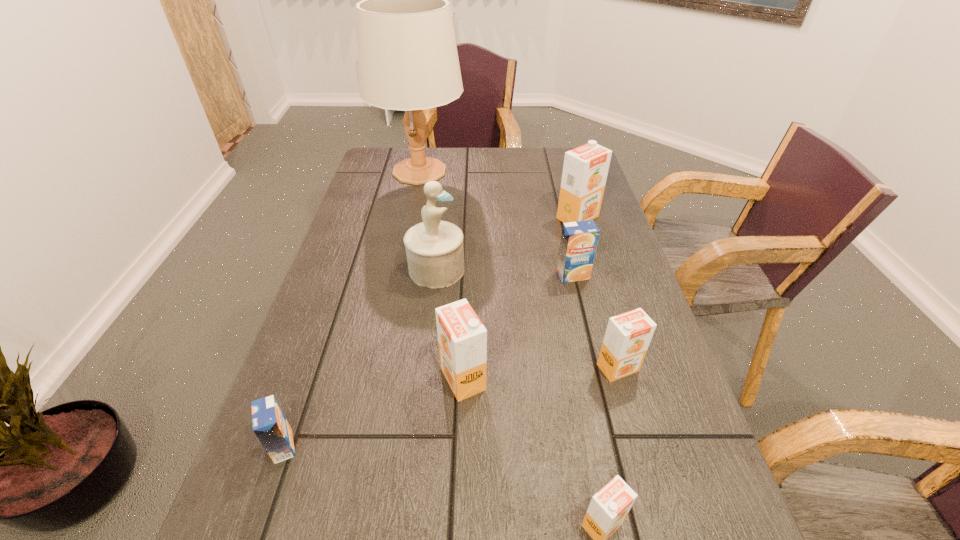
Image resolution: width=960 pixels, height=540 pixels. Find the location of `table lamp located at the left edge`. table lamp located at the left edge is located at coordinates (407, 55).

Image resolution: width=960 pixels, height=540 pixels. I want to click on orange_juice present at the left edge, so click(269, 424).

You are a GUI agent. You are given a task and a screenshot of the screen. Output one action in this format:
    pyautogui.click(x=<x>, y=<y>)
    Task: Click on the object situated at the far left corner
    
    Given the screenshot: What is the action you would take?
    pyautogui.click(x=407, y=55)

Identify the location of vacant space at the far edge of the desktop. This screenshot has width=960, height=540. (538, 176).

Locate an element on the screen. The image size is (960, 540). free space at the left edge is located at coordinates click(x=368, y=259).

In the image, there is a desktop. Where is `vacant space at the right edge`? This screenshot has width=960, height=540. vacant space at the right edge is located at coordinates (643, 386).

Locate an element on the screen. This screenshot has width=960, height=540. free location at the far left corner is located at coordinates (384, 163).

Where is `free space between the biggest orange orange juice and the white figurine`? Image resolution: width=960 pixels, height=540 pixels. free space between the biggest orange orange juice and the white figurine is located at coordinates [507, 244].

The width and height of the screenshot is (960, 540). I want to click on free space that is in between the second farthest orange juice and the second orange juice from left to right, so click(517, 327).

Image resolution: width=960 pixels, height=540 pixels. I want to click on free point between the third biggest orange orange juice and the farthest orange juice, so click(598, 293).